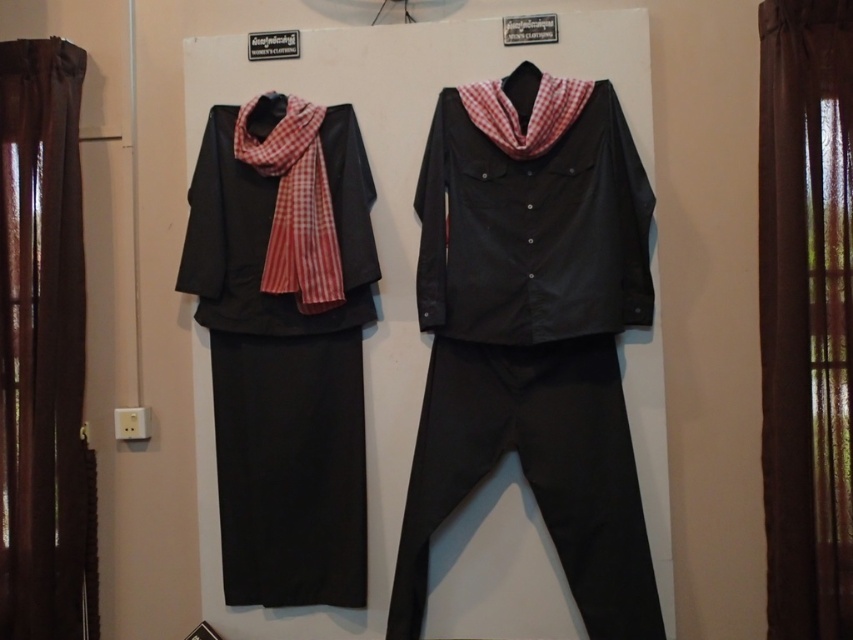
You are a store employee arranging mannequins. You need to place a new accessory between the matte black jacket at left and the red checkered scarf at center. Where should you position it?

The matte black jacket at left is to the left of the red checkered scarf at center, so you should place the new accessory between them, ensuring it is positioned to the right of the matte black jacket at left and to the left of the red checkered scarf at center.

Consider the image. You are a store employee arranging a display. You need to place a new accessory between the matte black skirt at left and the matte black jacket at center. Where should you position it to ensure it sits between them?

The accessory should be placed between the matte black skirt at left and the matte black jacket at center, positioned above the matte black skirt at left since it is located below the jacket.

You are a store employee arranging clothes. You need to place a new accessory between the matte black skirt at left and the matte black jacket at center. Where should you position it?

The accessory should be placed between the matte black skirt at left and the matte black jacket at center, to the right of the matte black skirt at left and to the left of the matte black jacket at center.